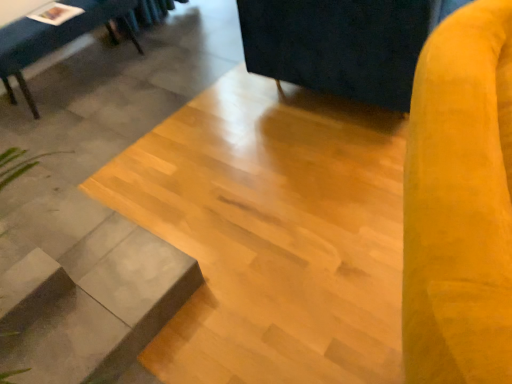
Find the location of a particular element. This screenshot has width=512, height=384. vacant space underneath matte black table at upper left (from a real-world perspective) is located at coordinates (90, 76).